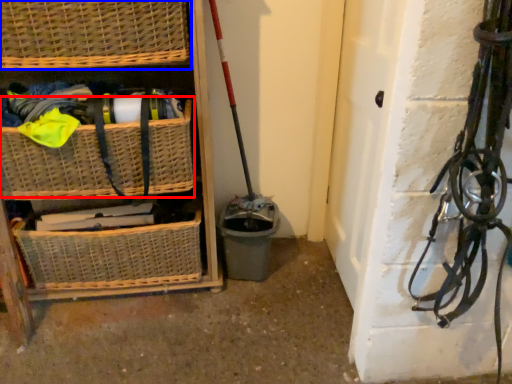
Question: Which of the following is the closest to the observer, basket (highlighted by a red box) or basket (highlighted by a blue box)?

Choices:
 (A) basket
 (B) basket

Answer: (B)